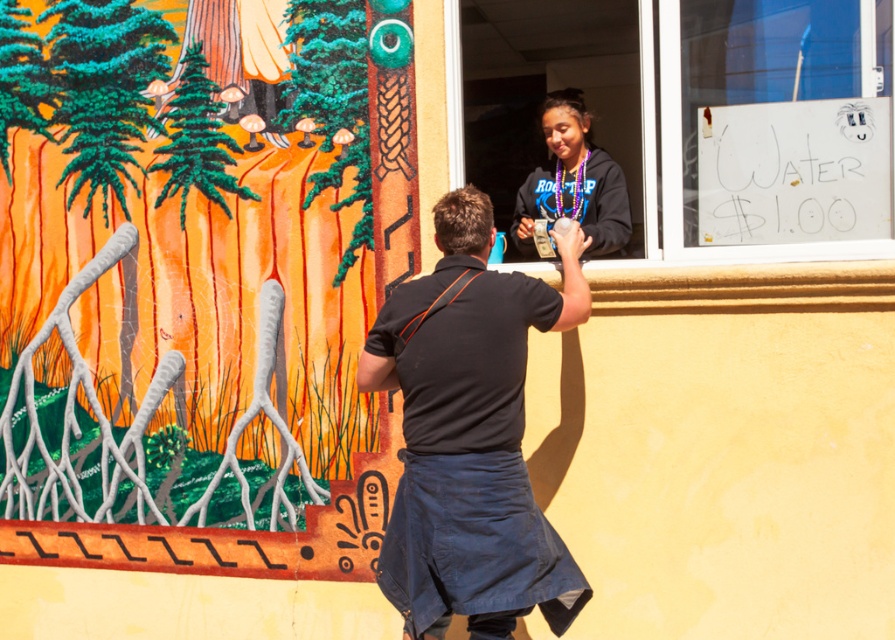
Who is higher up, matte orange wall at center or black cotton shirt at center?

Positioned higher is matte orange wall at center.

What do you see at coordinates (203, 353) in the screenshot? This screenshot has height=640, width=895. I see `matte orange wall at center` at bounding box center [203, 353].

Is point (95, 435) less distant than point (419, 477)?

No, it is behind (419, 477).

Identify the location of matte orange wall at center. (203, 353).

Can you confirm if black cotton shirt at center is positioned below matte black hoodie at center?

Yes.

Looking at this image, is black cotton shirt at center shorter than matte black hoodie at center?

No, black cotton shirt at center is not shorter than matte black hoodie at center.

Is point (507, 403) farther from camera compared to point (560, 109)?

No, (507, 403) is closer to viewer.

Find the location of a particular element. black cotton shirt at center is located at coordinates (470, 435).

Between matte orange wall at center and transparent glass window at upper center, which one is positioned higher?

Positioned higher is transparent glass window at upper center.

Between matte orange wall at center and transparent glass window at upper center, which one has less height?

With less height is transparent glass window at upper center.

Does point (297, 328) come closer to viewer compared to point (501, 3)?

Yes, it is in front of point (501, 3).

Where is `matte orange wall at center`? The image size is (895, 640). matte orange wall at center is located at coordinates (203, 353).